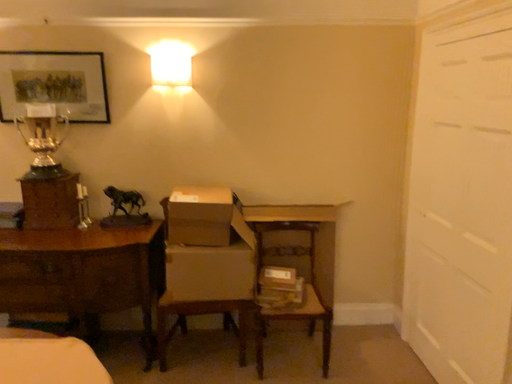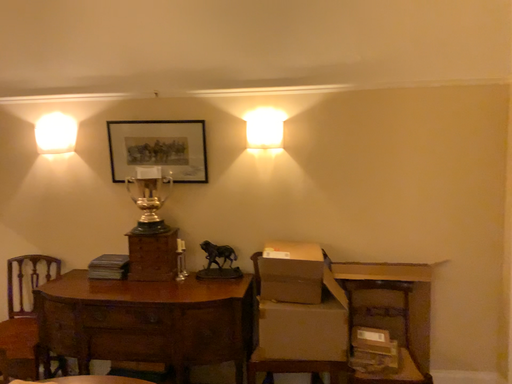
Question: How did the camera likely rotate when shooting the video?

Choices:
 (A) rotated downward
 (B) rotated upward

Answer: (B)